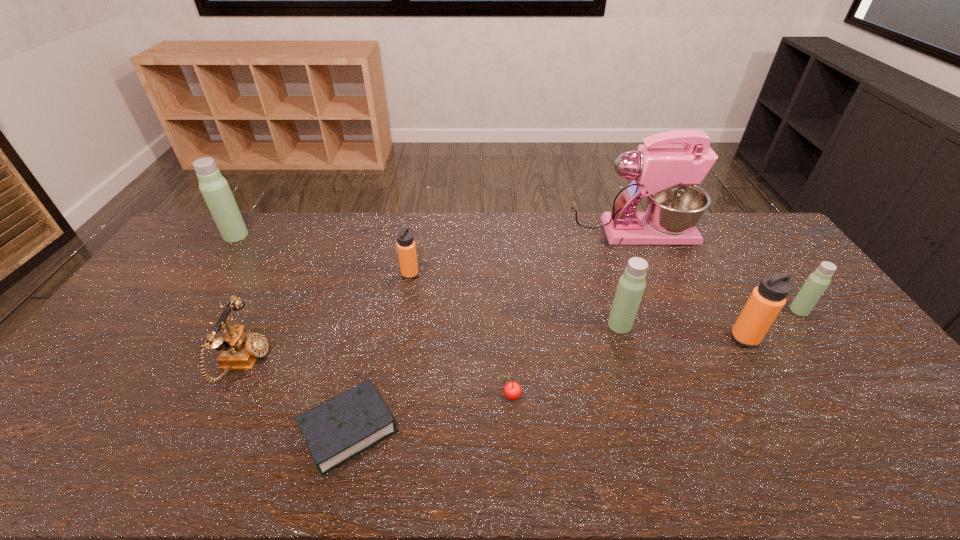
The height and width of the screenshot is (540, 960). I want to click on free space located 0.130m on the left of the rightmost object, so click(748, 310).

I want to click on vacant region located 0.170m on the right of the third farthest object, so click(x=469, y=274).

Locate an element on the screen. This screenshot has height=540, width=960. free location located on the dial number of the telephone is located at coordinates (379, 362).

Find the location of a particular element. This screenshot has height=540, width=960. vacant area situated 0.200m on the right of the fifth object from left to right is located at coordinates (599, 396).

Find the location of a particular element. vacant space positioned 0.180m on the right of the Bible is located at coordinates (474, 429).

Find the location of a particular element. The image size is (960, 540). mixer that is at the far edge is located at coordinates (667, 174).

The image size is (960, 540). I want to click on thermos bottle that is at the far edge, so click(x=214, y=188).

Identify the location of object located in the near edge section of the desktop. The image size is (960, 540). (341, 428).

You are a GUI agent. You are given a task and a screenshot of the screen. Output one action in this format:
    pyautogui.click(x=<x>, y=<y>)
    Task: Click on the object located in the left edge section of the desktop
    This screenshot has width=960, height=540.
    Given the screenshot: What is the action you would take?
    pyautogui.click(x=214, y=188)

Identify the location of object present at the right edge. Image resolution: width=960 pixels, height=540 pixels. (818, 281).